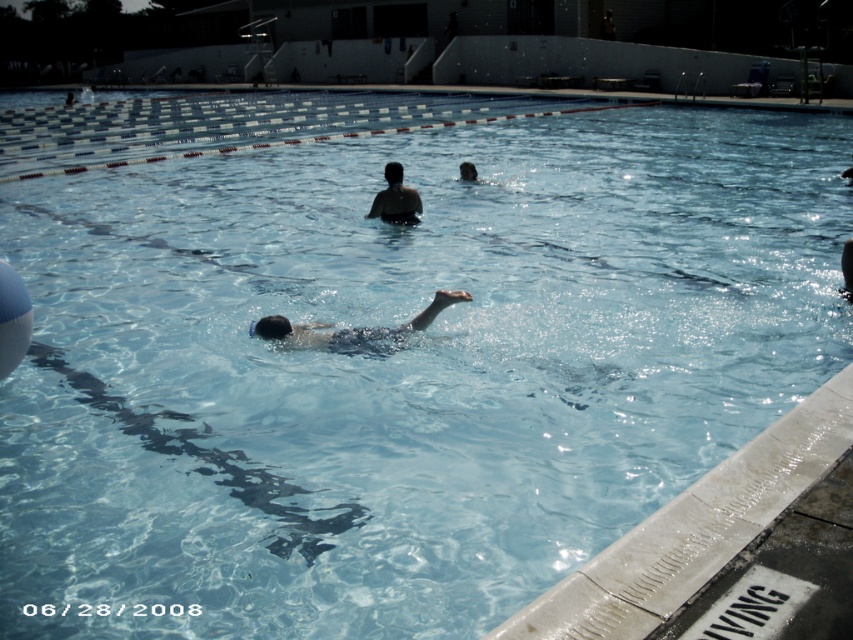
You are a photographer at the pool edge. You want to take a photo of the smooth skin swimmer at center and dark brown hair at center. Which one will appear bigger in the photo?

The smooth skin swimmer at center will appear bigger in the photo because it is larger in size than the dark brown hair at center.

You are a lifeguard observing the pool and need to ensure all swimmers are within the designated lanes. The smooth skin swimmer at center and the dark brown hair at center are both in the water. Which swimmer has a larger width?

The smooth skin swimmer at center has a larger width than the dark brown hair at center.